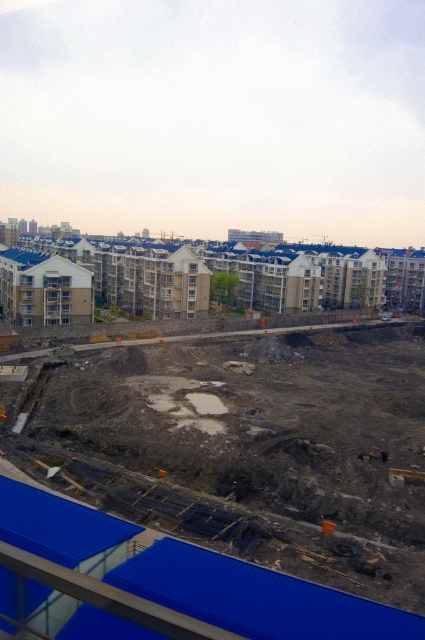
You are a construction worker standing at the edge of the construction site. You need to move materials from the dull gray concrete at center to the white concrete buildings at upper center. Which direction should you move the materials to reach the buildings?

The dull gray concrete at center is positioned on the right side of white concrete buildings at upper center. Therefore, to reach the white concrete buildings at upper center, you should move the materials to the left.

Based on the scene description, what color is the material located at the coordinates point (252, 448)?

The material at point (252, 448) is dull gray concrete.